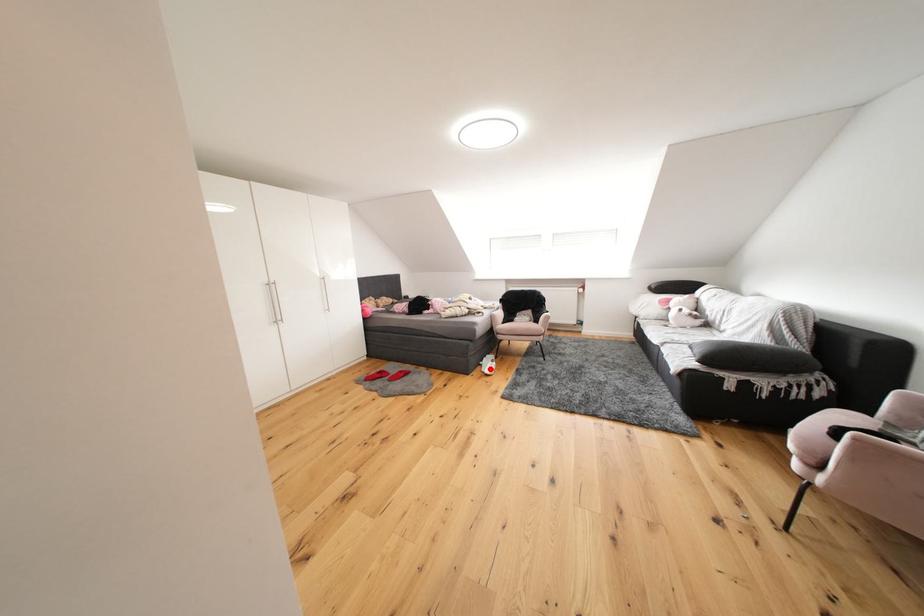
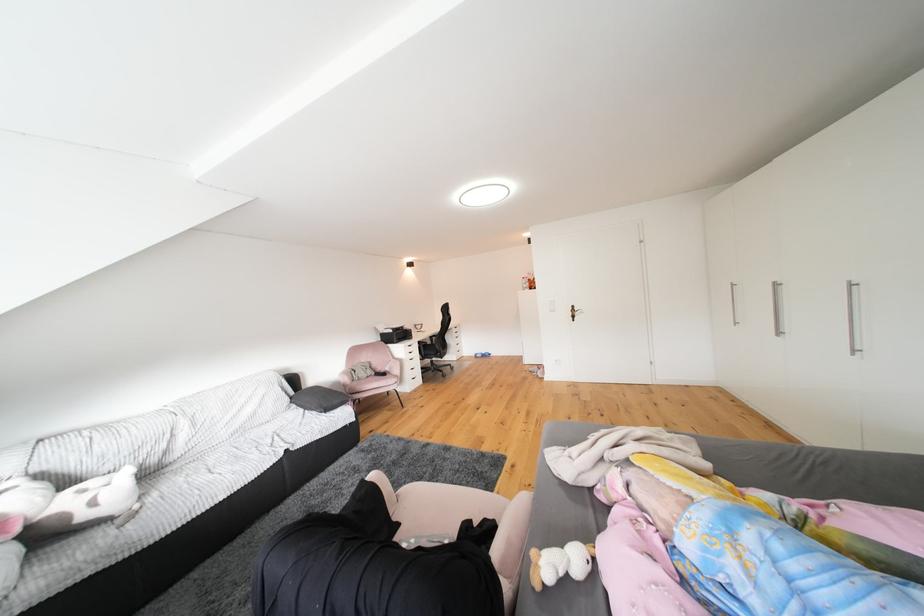
Question: I am providing you with two images of the same scene from different viewpoints. A red point is marked on the first image. Is the red point's position out of view in image 2?

Choices:
 (A) Yes
 (B) No

Answer: (A)